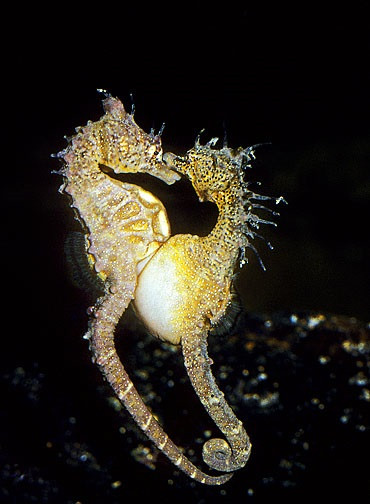
Where is `lights`? lights is located at coordinates (244, 402).